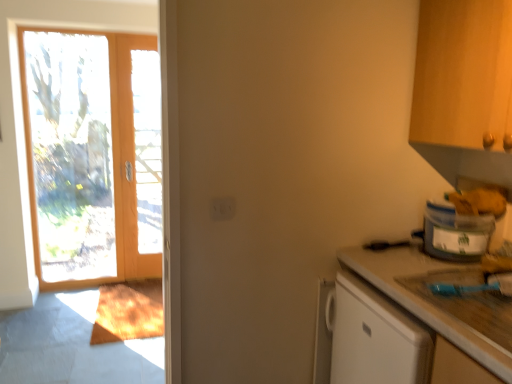
Identify the location of translucent plastic container at right. (455, 233).

Identify the location of smooth beige countertop at lower right. This screenshot has height=384, width=512. 424,300.

Does point (466, 260) appear closer or farther from the camera than point (493, 353)?

Point (466, 260).

From their relative heights in the image, would you say translucent plastic container at right is taller or shorter than smooth beige countertop at lower right?

translucent plastic container at right is shorter than smooth beige countertop at lower right.

Visually, is translucent plastic container at right positioned to the left or to the right of smooth beige countertop at lower right?

From the image, it's evident that translucent plastic container at right is to the right of smooth beige countertop at lower right.

Looking at this image, is matte wooden screen door at left next to translucent plastic container at right and touching it?

matte wooden screen door at left and translucent plastic container at right are not in contact.

From the image's perspective, which object appears higher, matte wooden screen door at left or translucent plastic container at right?

matte wooden screen door at left, from the image's perspective.

Considering the positions of objects matte wooden screen door at left and translucent plastic container at right in the image provided, who is more to the right, matte wooden screen door at left or translucent plastic container at right?

Positioned to the right is translucent plastic container at right.

Is matte wooden screen door at left aimed at translucent plastic container at right?

No.

Is clear glass door at left oriented away from smooth beige countertop at lower right?

That's not correct — clear glass door at left is not looking away from smooth beige countertop at lower right.

From their relative heights in the image, would you say clear glass door at left is taller or shorter than smooth beige countertop at lower right?

Clearly, clear glass door at left is taller compared to smooth beige countertop at lower right.

Can you tell me how much clear glass door at left and smooth beige countertop at lower right differ in facing direction?

91.7 degrees separate the facing orientations of clear glass door at left and smooth beige countertop at lower right.

Can you see clear glass door at left touching smooth beige countertop at lower right?

There is a gap between clear glass door at left and smooth beige countertop at lower right.

Is smooth beige countertop at lower right turned away from clear glass door at left?

smooth beige countertop at lower right is not turned away from clear glass door at left.

How distant is smooth beige countertop at lower right from clear glass door at left?

8.62 feet.

From a real-world perspective, which is physically above, smooth beige countertop at lower right or clear glass door at left?

From a 3D spatial view, clear glass door at left is above.

Would you say translucent plastic container at right is a long distance from clear glass door at left?

Yes, translucent plastic container at right and clear glass door at left are quite far apart.

From a real-world perspective, is translucent plastic container at right above or below clear glass door at left?

translucent plastic container at right is below clear glass door at left.

Does point (430, 214) come in front of point (42, 32)?

Yes, it is in front of point (42, 32).

In terms of height, does matte wooden screen door at left look taller or shorter compared to clear glass door at left?

matte wooden screen door at left is shorter than clear glass door at left.

Is matte wooden screen door at left located outside clear glass door at left?

That's correct, matte wooden screen door at left is outside of clear glass door at left.

Are matte wooden screen door at left and clear glass door at left located far from each other?

matte wooden screen door at left is near clear glass door at left, not far away.

Can you confirm if matte wooden screen door at left is positioned to the right of clear glass door at left?

Yes, matte wooden screen door at left is to the right of clear glass door at left.

Is the depth of clear glass door at left less than that of translucent plastic container at right?

No, clear glass door at left is further to the viewer.

Is clear glass door at left to the right of translucent plastic container at right from the viewer's perspective?

Incorrect, clear glass door at left is not on the right side of translucent plastic container at right.

This screenshot has width=512, height=384. Find the location of `appliance that appears in front of the clear glass door at left`. appliance that appears in front of the clear glass door at left is located at coordinates (455, 233).

Is point (62, 99) in front of point (467, 255)?

No, (62, 99) is behind (467, 255).

Locate an element on the screen. The width and height of the screenshot is (512, 384). countertop below the translucent plastic container at right (from the image's perspective) is located at coordinates (424, 300).

Where is `appliance below the matte wooden screen door at left (from a real-world perspective)`? appliance below the matte wooden screen door at left (from a real-world perspective) is located at coordinates (455, 233).

From the picture: From the image, which object appears to be farther from smooth beige countertop at lower right, clear glass door at left or matte wooden screen door at left?

clear glass door at left.

Looking at the image, which one is located further to clear glass door at left, translucent plastic container at right or matte wooden screen door at left?

Based on the image, translucent plastic container at right appears to be further to clear glass door at left.

Estimate the real-world distances between objects in this image. Which object is closer to translucent plastic container at right, clear glass door at left or smooth beige countertop at lower right?

smooth beige countertop at lower right lies closer to translucent plastic container at right than the other object.

Considering their positions, is smooth beige countertop at lower right positioned further to clear glass door at left than translucent plastic container at right?

Among the two, translucent plastic container at right is located further to clear glass door at left.

Considering their positions, is matte wooden screen door at left positioned closer to translucent plastic container at right than clear glass door at left?

Based on the image, matte wooden screen door at left appears to be nearer to translucent plastic container at right.

Considering their positions, is translucent plastic container at right positioned further to matte wooden screen door at left than smooth beige countertop at lower right?

translucent plastic container at right is further to matte wooden screen door at left.

Based on their spatial positions, is clear glass door at left or smooth beige countertop at lower right further from matte wooden screen door at left?

smooth beige countertop at lower right is positioned further to the anchor matte wooden screen door at left.

Looking at the image, which one is located closer to clear glass door at left, matte wooden screen door at left or translucent plastic container at right?

matte wooden screen door at left.

Locate an element on the screen. The height and width of the screenshot is (384, 512). countertop situated between clear glass door at left and translucent plastic container at right from left to right is located at coordinates (424, 300).

You are a GUI agent. You are given a task and a screenshot of the screen. Output one action in this format:
    pyautogui.click(x=<x>, y=<y>)
    Task: Click on the screen door situated between clear glass door at left and translucent plastic container at right from left to right
    This screenshot has width=512, height=384.
    Given the screenshot: What is the action you would take?
    pyautogui.click(x=131, y=156)

Where is `appliance between smooth beige countertop at lower right and matte wooden screen door at left from front to back`? This screenshot has width=512, height=384. appliance between smooth beige countertop at lower right and matte wooden screen door at left from front to back is located at coordinates (455, 233).

You are a GUI agent. You are given a task and a screenshot of the screen. Output one action in this format:
    pyautogui.click(x=<x>, y=<y>)
    Task: Click on the door between smooth beige countertop at lower right and matte wooden screen door at left in the front-back direction
    
    Given the screenshot: What is the action you would take?
    pyautogui.click(x=85, y=154)